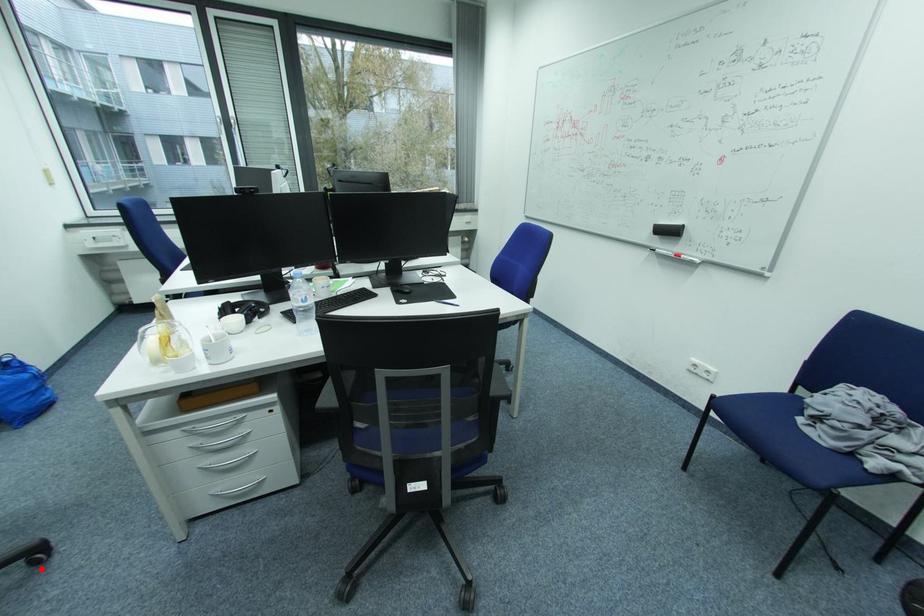
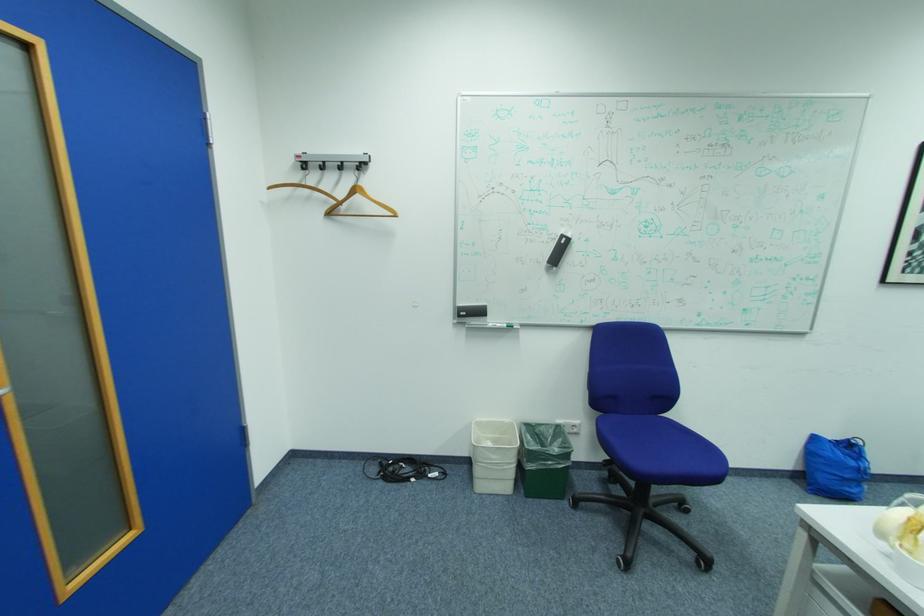
In the second image, find the point that corresponds to the highlighted location in the first image.

(703, 565)